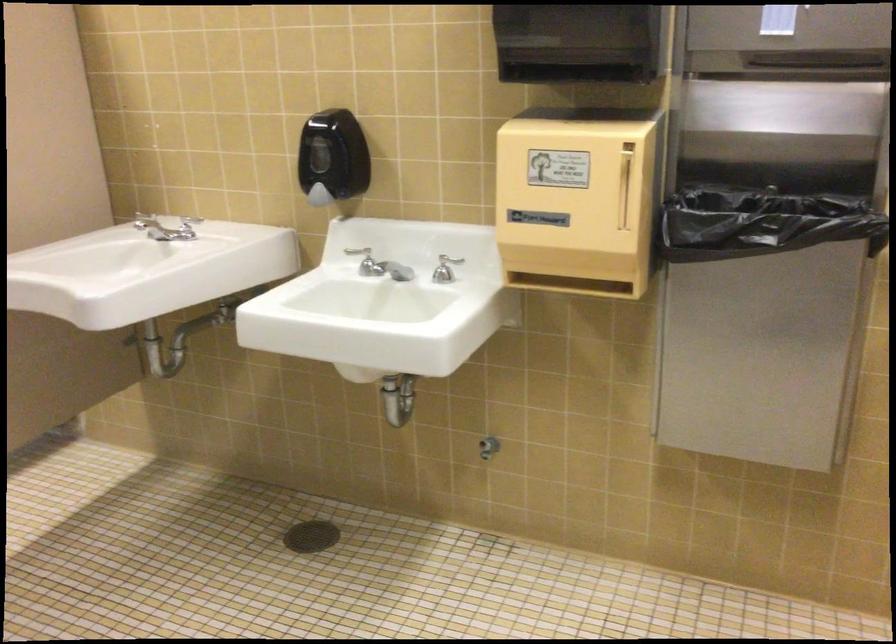
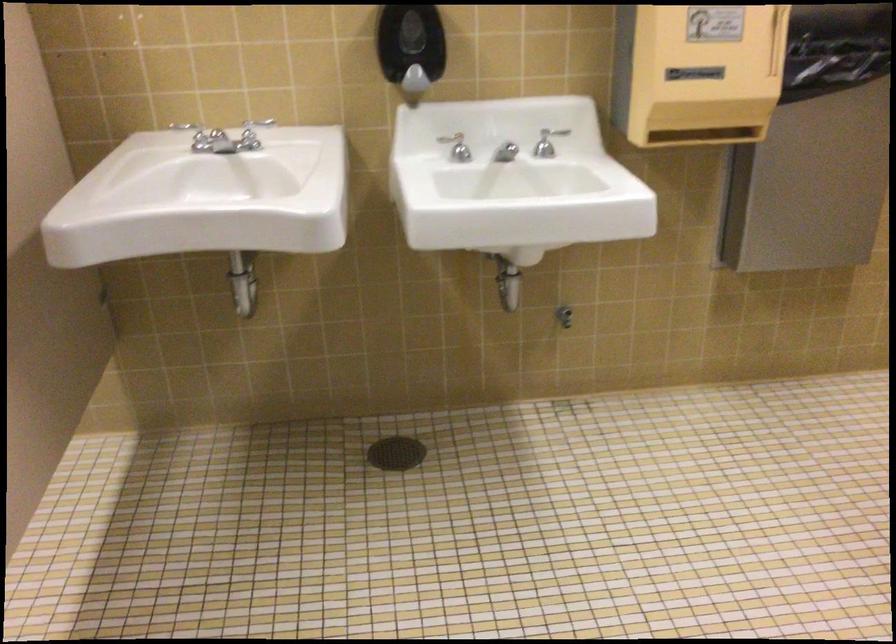
Where in the second image is the point corresponding to pixel 192 225 from the first image?

(194, 135)